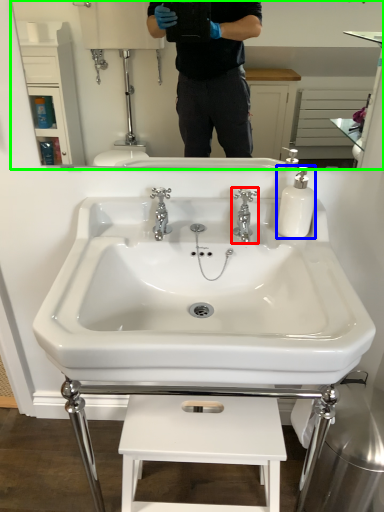
Question: Which object is positioned farthest from tap (highlighted by a red box)? Select from soap dispenser (highlighted by a blue box) and mirror (highlighted by a green box).

Choices:
 (A) soap dispenser
 (B) mirror

Answer: (B)